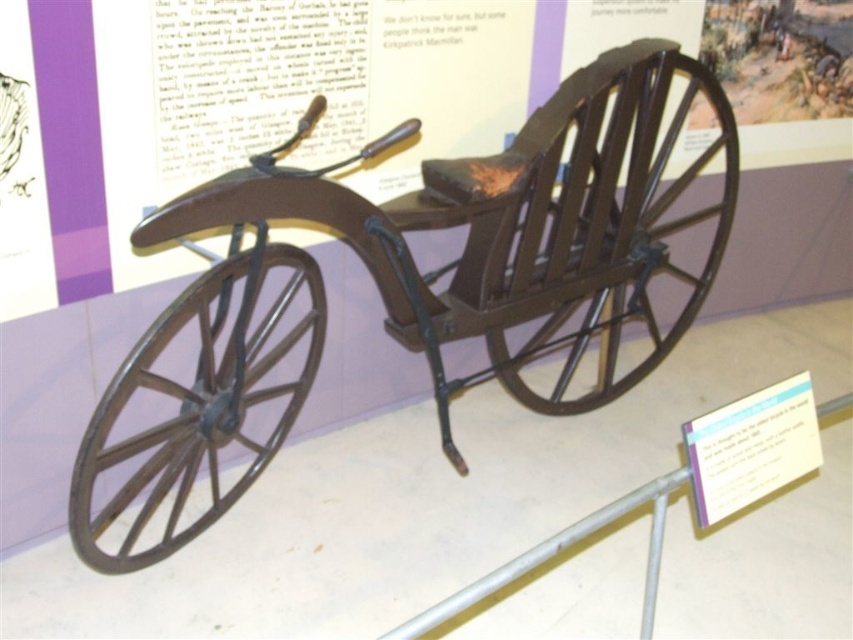
Question: Which of the following is the farthest from the observer?

Choices:
 (A) (656, 353)
 (B) (231, 278)
 (C) (73, 496)

Answer: (A)

Question: Does dark brown wood wagon at center come in front of rusty metal wheel at left?

Choices:
 (A) yes
 (B) no

Answer: (A)

Question: Is the position of dark brown wood wagon at center more distant than that of rusty metal wheel at left?

Choices:
 (A) no
 (B) yes

Answer: (A)

Question: Which point is closer to the camera?

Choices:
 (A) 238,326
 (B) 129,547

Answer: (A)

Question: Which point appears closest to the camera in this image?

Choices:
 (A) coord(711,243)
 (B) coord(120,458)
 (C) coord(712,257)

Answer: (B)

Question: Considering the relative positions of rusty metal wheel at left and dark brown wood wheel at center in the image provided, where is rusty metal wheel at left located with respect to dark brown wood wheel at center?

Choices:
 (A) left
 (B) right

Answer: (A)